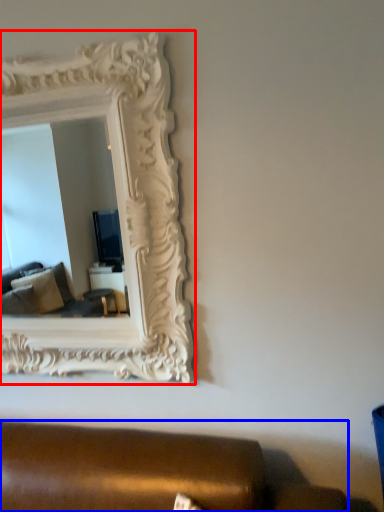
Question: Which object is further to the camera taking this photo, picture frame (highlighted by a red box) or studio couch (highlighted by a blue box)?

Choices:
 (A) picture frame
 (B) studio couch

Answer: (A)